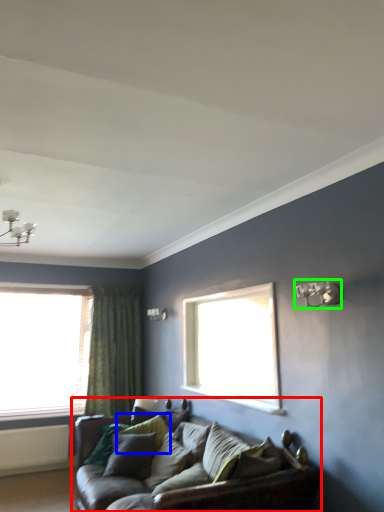
Question: Considering the real-world distances, which object is farthest from studio couch (highlighted by a red box)? pillow (highlighted by a blue box) or light fixture (highlighted by a green box)?

Choices:
 (A) pillow
 (B) light fixture

Answer: (B)